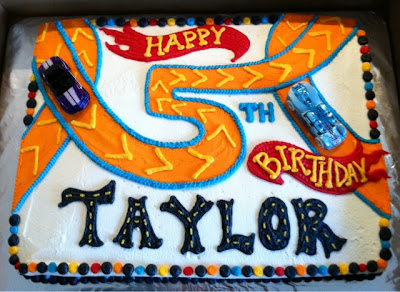
This screenshot has width=400, height=292. I want to click on box, so click(x=64, y=8).